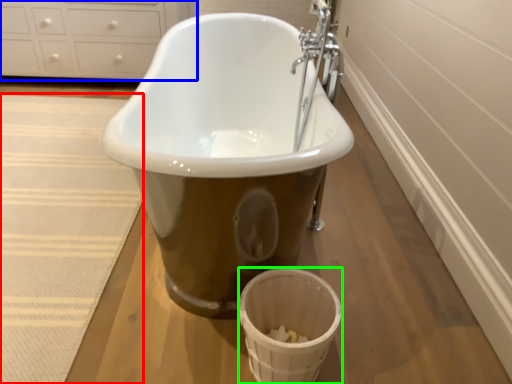
Question: Which is farther away from bath mat (highlighted by a red box)? cabinetry (highlighted by a blue box) or basket (highlighted by a green box)?

Choices:
 (A) cabinetry
 (B) basket

Answer: (A)